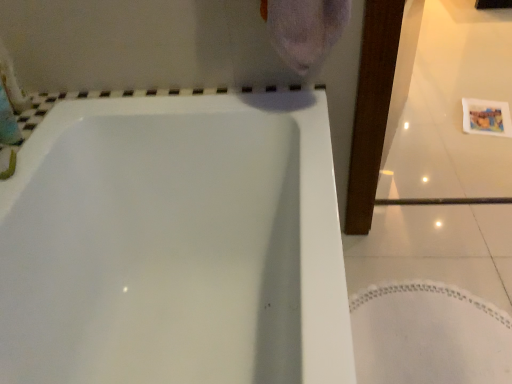
Where is `white fabric bath mat at lower right`? white fabric bath mat at lower right is located at coordinates (429, 335).

What do you see at coordinates (429, 335) in the screenshot? I see `white fabric bath mat at lower right` at bounding box center [429, 335].

In order to face white fabric bath mat at lower right, should I rotate leftwards or rightwards?

Rotate your view right by about 21.534°.

Where is `white glossy bathtub at center`? The image size is (512, 384). white glossy bathtub at center is located at coordinates (175, 244).

What do you see at coordinates (175, 244) in the screenshot?
I see `white glossy bathtub at center` at bounding box center [175, 244].

Locate an element on the screen. Image resolution: width=512 pixels, height=384 pixels. white fabric bath mat at lower right is located at coordinates (429, 335).

Which object is positioned more to the right, white fabric bath mat at lower right or white glossy bathtub at center?

white fabric bath mat at lower right.

Relative to white glossy bathtub at center, is white fabric bath mat at lower right in front or behind?

white fabric bath mat at lower right is behind white glossy bathtub at center.

Does point (504, 366) appear closer or farther from the camera than point (292, 199)?

Point (504, 366) is farther from the camera than point (292, 199).

From the image's perspective, is white fabric bath mat at lower right below white glossy bathtub at center?

Indeed, from the image's perspective, white fabric bath mat at lower right is shown beneath white glossy bathtub at center.

From a real-world perspective, relative to white glossy bathtub at center, is white fabric bath mat at lower right vertically above or below?

From a real-world perspective, white fabric bath mat at lower right is physically below white glossy bathtub at center.

Between white fabric bath mat at lower right and white glossy bathtub at center, which one has larger width?

Wider between the two is white glossy bathtub at center.

Considering the sizes of objects white fabric bath mat at lower right and white glossy bathtub at center in the image provided, who is shorter, white fabric bath mat at lower right or white glossy bathtub at center?

With less height is white fabric bath mat at lower right.

Considering the sizes of objects white fabric bath mat at lower right and white glossy bathtub at center in the image provided, who is bigger, white fabric bath mat at lower right or white glossy bathtub at center?

With larger size is white glossy bathtub at center.

Would you say white fabric bath mat at lower right is outside white glossy bathtub at center?

Absolutely, white fabric bath mat at lower right is external to white glossy bathtub at center.

Are white fabric bath mat at lower right and white glossy bathtub at center located far from each other?

No, white fabric bath mat at lower right is not far away from white glossy bathtub at center.

Is white fabric bath mat at lower right looking in the opposite direction of white glossy bathtub at center?

That's right, white fabric bath mat at lower right is facing away from white glossy bathtub at center.

Where is `bathtub positioned vertically above the white fabric bath mat at lower right (from a real-world perspective)`? bathtub positioned vertically above the white fabric bath mat at lower right (from a real-world perspective) is located at coordinates (175, 244).

Considering the relative positions of white glossy bathtub at center and white fabric bath mat at lower right in the image provided, is white glossy bathtub at center to the left or to the right of white fabric bath mat at lower right?

white glossy bathtub at center is positioned on white fabric bath mat at lower right's left side.

Does white glossy bathtub at center lie in front of white fabric bath mat at lower right?

Yes, white glossy bathtub at center is in front of white fabric bath mat at lower right.

Is point (172, 273) farther from viewer compared to point (453, 309)?

No.

From the image's perspective, which one is positioned lower, white glossy bathtub at center or white fabric bath mat at lower right?

white fabric bath mat at lower right, from the image's perspective.

From a real-world perspective, which object rests below the other?

In real-world perspective, white fabric bath mat at lower right is lower.

Considering the sizes of white glossy bathtub at center and white fabric bath mat at lower right in the image, is white glossy bathtub at center wider or thinner than white fabric bath mat at lower right?

A: white glossy bathtub at center is wider than white fabric bath mat at lower right.

Based on the photo, considering the sizes of objects white glossy bathtub at center and white fabric bath mat at lower right in the image provided, who is shorter, white glossy bathtub at center or white fabric bath mat at lower right?

Standing shorter between the two is white fabric bath mat at lower right.

Considering the relative sizes of white glossy bathtub at center and white fabric bath mat at lower right in the image provided, is white glossy bathtub at center smaller than white fabric bath mat at lower right?

No, white glossy bathtub at center is not smaller than white fabric bath mat at lower right.

Is white glossy bathtub at center positioned beyond the bounds of white fabric bath mat at lower right?

That's correct, white glossy bathtub at center is outside of white fabric bath mat at lower right.

Is the surface of white glossy bathtub at center in direct contact with white fabric bath mat at lower right?

No, white glossy bathtub at center is not with white fabric bath mat at lower right.

Is white glossy bathtub at center positioned with its back to white fabric bath mat at lower right?

No, white glossy bathtub at center is not facing the opposite direction of white fabric bath mat at lower right.

How many degrees apart are the facing directions of white glossy bathtub at center and white fabric bath mat at lower right?

They differ by 7.6e-05 degrees in their facing directions.

You are a GUI agent. You are given a task and a screenshot of the screen. Output one action in this format:
    pyautogui.click(x=<x>, y=<y>)
    Task: Click on the bathtub above the white fabric bath mat at lower right (from the image's perspective)
    
    Given the screenshot: What is the action you would take?
    tap(175, 244)

Find the location of `bath mat located below the white glossy bathtub at center (from the image's perspective)`. bath mat located below the white glossy bathtub at center (from the image's perspective) is located at coordinates (429, 335).

Identify the location of bathtub above the white fabric bath mat at lower right (from a real-world perspective). (175, 244).